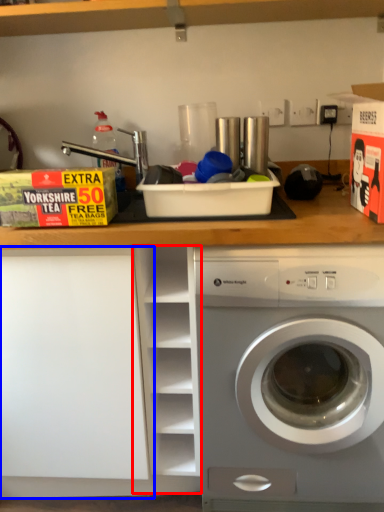
Question: Among these objects, which one is farthest to the camera, cabinet (highlighted by a red box) or shelf (highlighted by a blue box)?

Choices:
 (A) cabinet
 (B) shelf

Answer: (B)